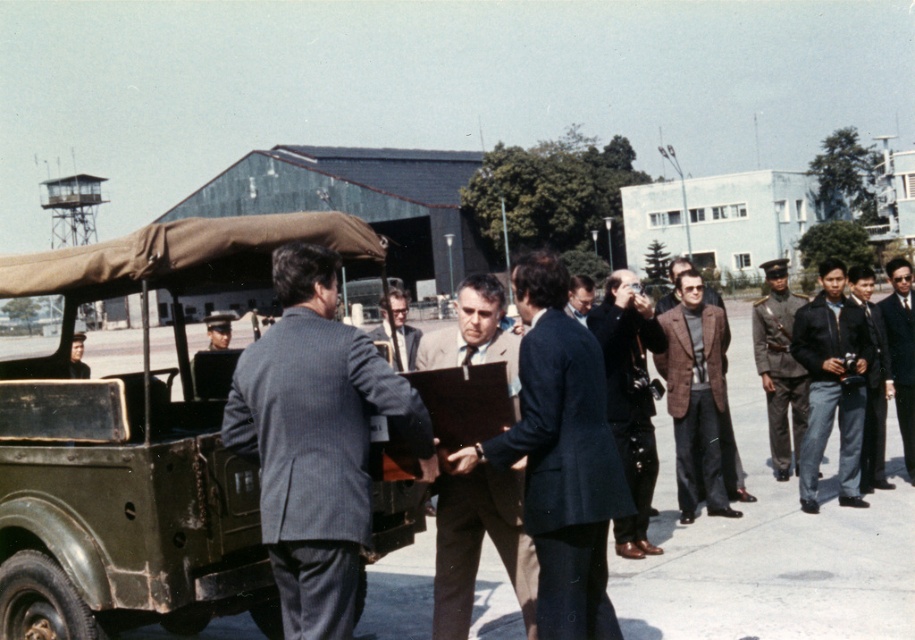
You are a photographer at the airbase and need to arrange the light brown suit at center and the dark brown uniform at right for a group photo. Which person should stand closer to the camera to ensure both are in focus?

The light brown suit at center should stand closer to the camera because it is shorter than the dark brown uniform at right, so adjusting their positions will help keep both in focus.

You are standing at the origin point of the coordinate system. Where is the light brown suit at center located in terms of coordinates?

The light brown suit at center is located at coordinates point (480,545).